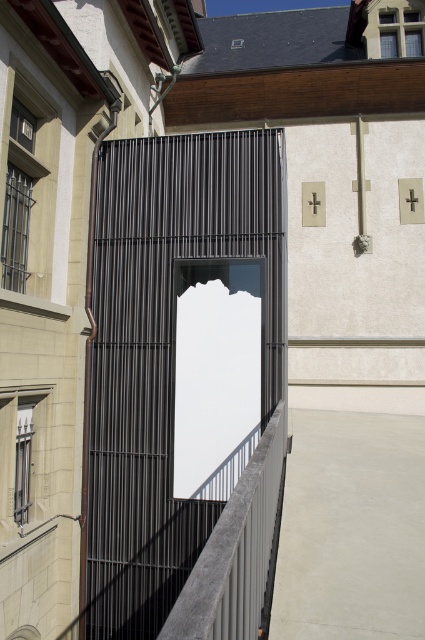
Question: Among these points, which one is farthest from the camera?

Choices:
 (A) (221, 541)
 (B) (19, 630)

Answer: (B)

Question: Does smooth gray metal balustrade at center have a greater width compared to smooth concrete hole at lower left?

Choices:
 (A) yes
 (B) no

Answer: (A)

Question: Which point is farther from the camera taking this photo?

Choices:
 (A) coord(27,632)
 (B) coord(221,564)

Answer: (A)

Question: In this image, where is smooth gray metal balustrade at center located relative to smooth concrete hole at lower left?

Choices:
 (A) right
 (B) left

Answer: (A)

Question: Is smooth gray metal balustrade at center wider than smooth concrete hole at lower left?

Choices:
 (A) no
 (B) yes

Answer: (B)